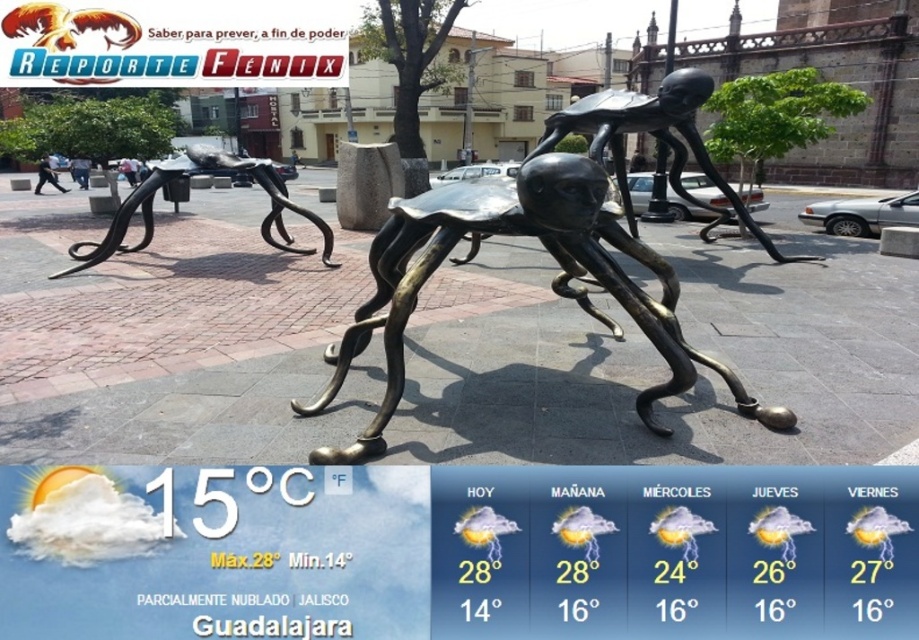
Question: Which point appears closest to the camera in this image?

Choices:
 (A) (598, 243)
 (B) (267, 182)

Answer: (A)

Question: Does metallic spider at center appear over bronze sculpture at center?

Choices:
 (A) yes
 (B) no

Answer: (B)

Question: Is metallic spider at center smaller than bronze sculpture at center?

Choices:
 (A) no
 (B) yes

Answer: (B)

Question: Which object appears closest to the camera in this image?

Choices:
 (A) metallic spider at center
 (B) bronze sculpture at center

Answer: (A)

Question: Observing the image, what is the correct spatial positioning of metallic spider at center in reference to bronze sculpture at center?

Choices:
 (A) above
 (B) below

Answer: (B)